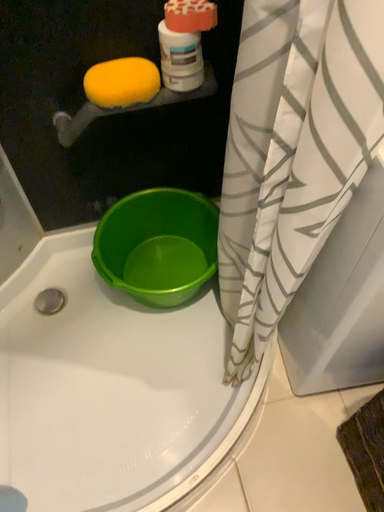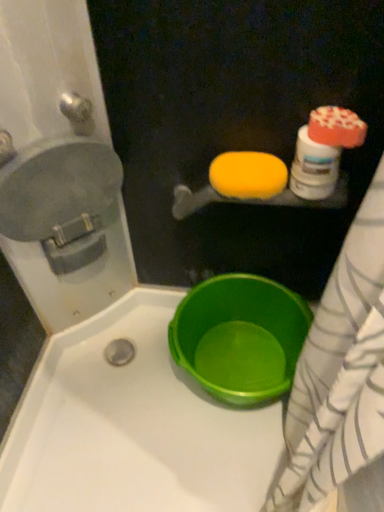
Question: Which way did the camera rotate in the video?

Choices:
 (A) rotated right
 (B) rotated left

Answer: (B)